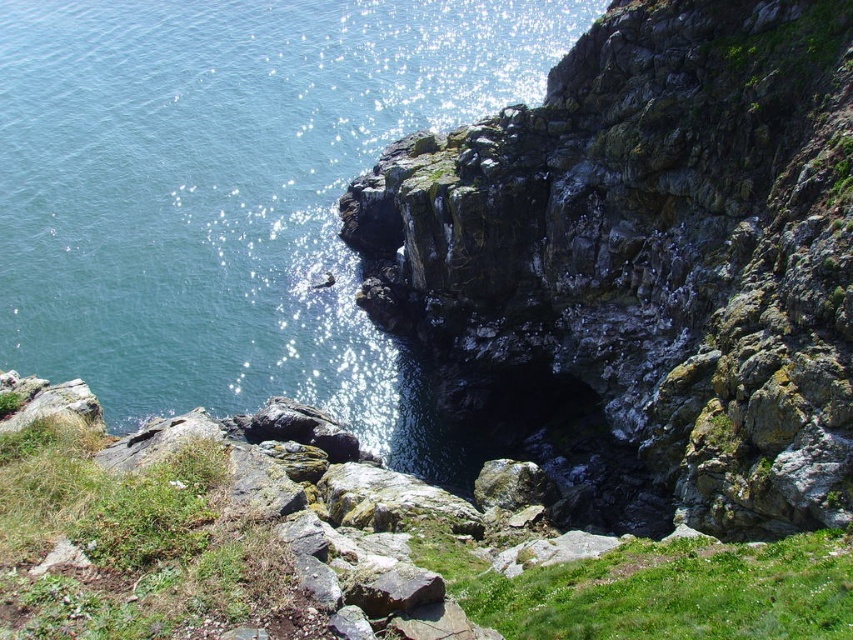
Question: Does rough stone cave at center appear on the left side of blue water at center?

Choices:
 (A) no
 (B) yes

Answer: (A)

Question: Which of the following is the farthest from the observer?

Choices:
 (A) (840, 35)
 (B) (543, 33)

Answer: (B)

Question: Considering the relative positions of rough stone cave at center and blue water at center in the image provided, where is rough stone cave at center located with respect to blue water at center?

Choices:
 (A) left
 (B) right

Answer: (B)

Question: Does rough stone cave at center have a smaller size compared to blue water at center?

Choices:
 (A) no
 (B) yes

Answer: (B)